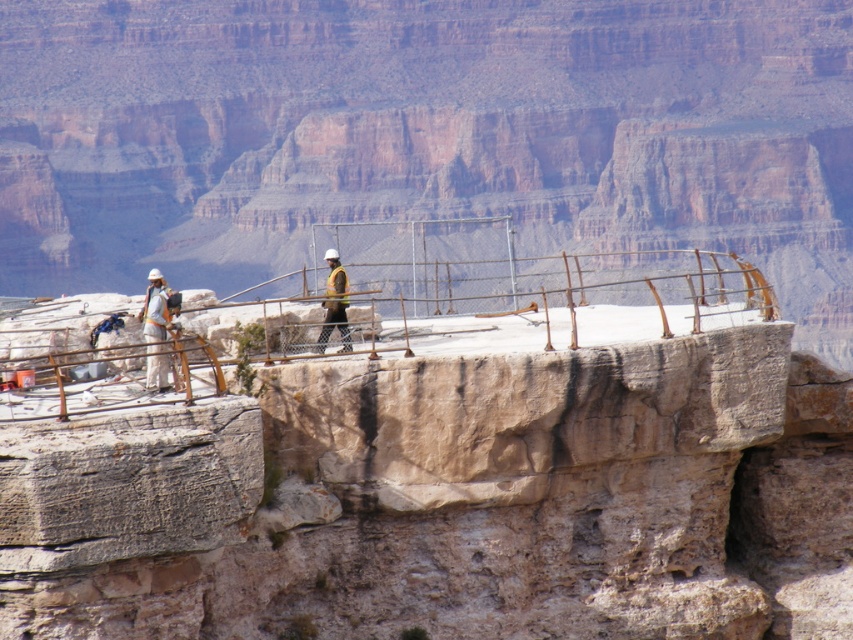
Question: Does smooth concrete platform at center come behind hard hat construction worker at center?

Choices:
 (A) no
 (B) yes

Answer: (A)

Question: Estimate the real-world distances between objects in this image. Which object is farther from the hard hat construction worker at center?

Choices:
 (A) white hard hat at left
 (B) smooth concrete platform at center

Answer: (A)

Question: Which point is farther from the camera taking this photo?

Choices:
 (A) (838, 76)
 (B) (351, 349)
 (C) (152, 268)
 (D) (334, 616)

Answer: (A)

Question: Is smooth concrete platform at center bigger than white hard hat at left?

Choices:
 (A) no
 (B) yes

Answer: (B)

Question: Can you confirm if smooth concrete platform at center is positioned above white hard hat at left?

Choices:
 (A) yes
 (B) no

Answer: (B)

Question: Which object is farther from the camera taking this photo?

Choices:
 (A) smooth concrete platform at center
 (B) hard hat construction worker at center

Answer: (B)